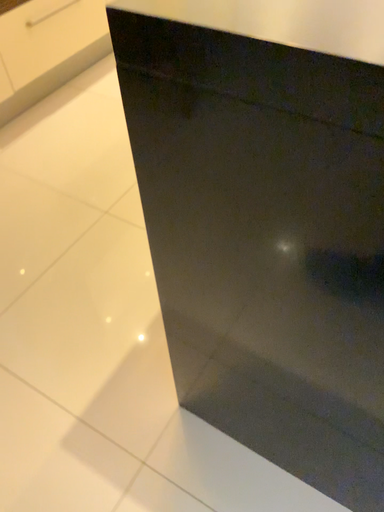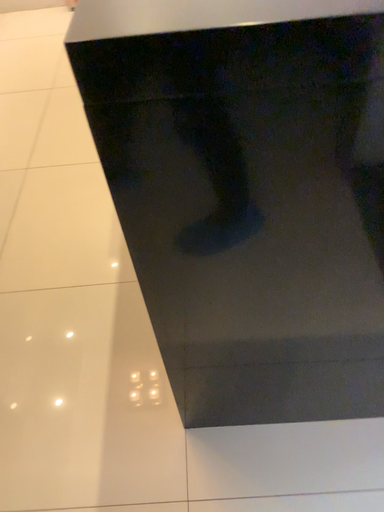
Question: How did the camera likely rotate when shooting the video?

Choices:
 (A) rotated left
 (B) rotated right

Answer: (B)